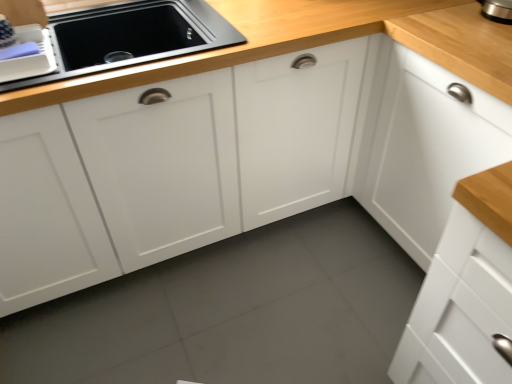
This screenshot has width=512, height=384. Describe the element at coordinates (130, 36) in the screenshot. I see `matte black sink at upper left` at that location.

In order to face matte black sink at upper left, should I rotate leftwards or rightwards?

You should rotate left by 18.980 degrees.

Find the location of a particular element. This screenshot has height=384, width=512. matte plastic dish rack at upper left is located at coordinates (30, 56).

Is matte black sink at upper left facing towards white matte cabinet at upper right?

No, matte black sink at upper left does not turn towards white matte cabinet at upper right.

Which object is positioned more to the left, matte black sink at upper left or white matte cabinet at upper right?

Positioned to the left is matte black sink at upper left.

Is point (173, 34) closer to viewer compared to point (443, 187)?

That is False.

Where is `cabinetry that is in front of the matte black sink at upper left`? This screenshot has width=512, height=384. cabinetry that is in front of the matte black sink at upper left is located at coordinates (419, 143).

Between matte plastic dish rack at upper left and matte black sink at upper left, which one appears on the left side from the viewer's perspective?

matte plastic dish rack at upper left is more to the left.

In terms of size, does matte plastic dish rack at upper left appear bigger or smaller than matte black sink at upper left?

matte plastic dish rack at upper left is smaller than matte black sink at upper left.

From the picture: Does matte plastic dish rack at upper left have a greater height compared to matte black sink at upper left?

Incorrect, the height of matte plastic dish rack at upper left is not larger of that of matte black sink at upper left.

This screenshot has height=384, width=512. I want to click on appliance above the matte black sink at upper left (from a real-world perspective), so click(30, 56).

Choose the correct answer: Is matte black sink at upper left inside matte plastic dish rack at upper left or outside it?

matte black sink at upper left lies outside matte plastic dish rack at upper left.

Which is more to the left, matte black sink at upper left or matte plastic dish rack at upper left?

Positioned to the left is matte plastic dish rack at upper left.

Is matte black sink at upper left aimed at matte plastic dish rack at upper left?

No, matte black sink at upper left is not facing towards matte plastic dish rack at upper left.

This screenshot has width=512, height=384. In the image, there is a matte plastic dish rack at upper left. Identify the location of home appliance below it (from a real-world perspective). (130, 36).

What's the angular difference between white matte cabinet at upper right and matte plastic dish rack at upper left's facing directions?

90 degrees.

Is white matte cabinet at upper right not near matte plastic dish rack at upper left?

white matte cabinet at upper right is far away from matte plastic dish rack at upper left.

Can you confirm if white matte cabinet at upper right is thinner than matte plastic dish rack at upper left?

No, white matte cabinet at upper right is not thinner than matte plastic dish rack at upper left.

Between white matte cabinet at upper right and matte plastic dish rack at upper left, which one has less height?

Standing shorter between the two is matte plastic dish rack at upper left.

Which is correct: white matte cabinet at upper right is inside matte black sink at upper left, or outside of it?

white matte cabinet at upper right is not enclosed by matte black sink at upper left.

Could you tell me if white matte cabinet at upper right is facing matte black sink at upper left?

No, white matte cabinet at upper right does not turn towards matte black sink at upper left.

From the picture: From a real-world perspective, relative to matte black sink at upper left, is white matte cabinet at upper right vertically above or below?

From a real-world perspective, white matte cabinet at upper right is physically below matte black sink at upper left.

Is white matte cabinet at upper right bigger or smaller than matte black sink at upper left?

Clearly, white matte cabinet at upper right is larger in size than matte black sink at upper left.

From a real-world perspective, is matte plastic dish rack at upper left over white matte cabinet at upper right?

Yes.

Is matte plastic dish rack at upper left to the left or to the right of white matte cabinet at upper right in the image?

Based on their positions, matte plastic dish rack at upper left is located to the left of white matte cabinet at upper right.

Considering the relative sizes of matte plastic dish rack at upper left and white matte cabinet at upper right in the image provided, is matte plastic dish rack at upper left taller than white matte cabinet at upper right?

No, matte plastic dish rack at upper left is not taller than white matte cabinet at upper right.

Who is more distant, matte plastic dish rack at upper left or white matte cabinet at upper right?

matte plastic dish rack at upper left is further away from the camera.

Find the location of a particular element. cabinetry in front of the matte black sink at upper left is located at coordinates (419, 143).

The height and width of the screenshot is (384, 512). I want to click on home appliance that appears below the matte plastic dish rack at upper left (from a real-world perspective), so click(x=130, y=36).

Which object lies nearer to the anchor point white matte cabinet at upper right, matte black sink at upper left or matte plastic dish rack at upper left?

matte black sink at upper left lies closer to white matte cabinet at upper right than the other object.

Consider the image. Looking at the image, which one is located closer to white matte cabinet at upper right, matte plastic dish rack at upper left or matte black sink at upper left?

Based on the image, matte black sink at upper left appears to be nearer to white matte cabinet at upper right.

Considering their positions, is white matte cabinet at upper right positioned closer to matte plastic dish rack at upper left than matte black sink at upper left?

Based on the image, matte black sink at upper left appears to be nearer to matte plastic dish rack at upper left.

From the image, which object appears to be nearer to matte black sink at upper left, matte plastic dish rack at upper left or white matte cabinet at upper right?

matte plastic dish rack at upper left is closer to matte black sink at upper left.

Estimate the real-world distances between objects in this image. Which object is closer to matte black sink at upper left, white matte cabinet at upper right or matte plastic dish rack at upper left?

matte plastic dish rack at upper left is positioned closer to the anchor matte black sink at upper left.

Estimate the real-world distances between objects in this image. Which object is further from matte plastic dish rack at upper left, matte black sink at upper left or white matte cabinet at upper right?

white matte cabinet at upper right lies further to matte plastic dish rack at upper left than the other object.

Find the location of a particular element. The width and height of the screenshot is (512, 384). home appliance located between matte plastic dish rack at upper left and white matte cabinet at upper right in the left-right direction is located at coordinates (130, 36).